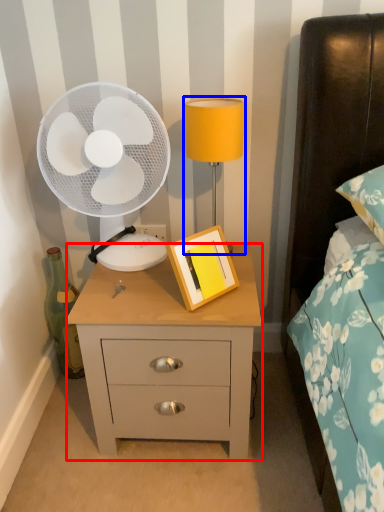
Question: Which of the following is the farthest to the observer, nightstand (highlighted by a red box) or bedside lamp (highlighted by a blue box)?

Choices:
 (A) nightstand
 (B) bedside lamp

Answer: (B)